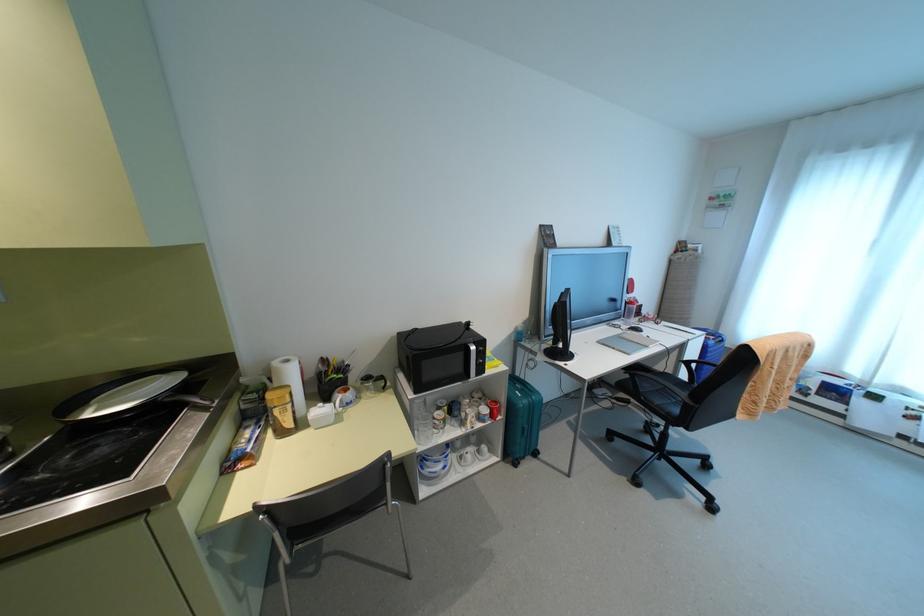
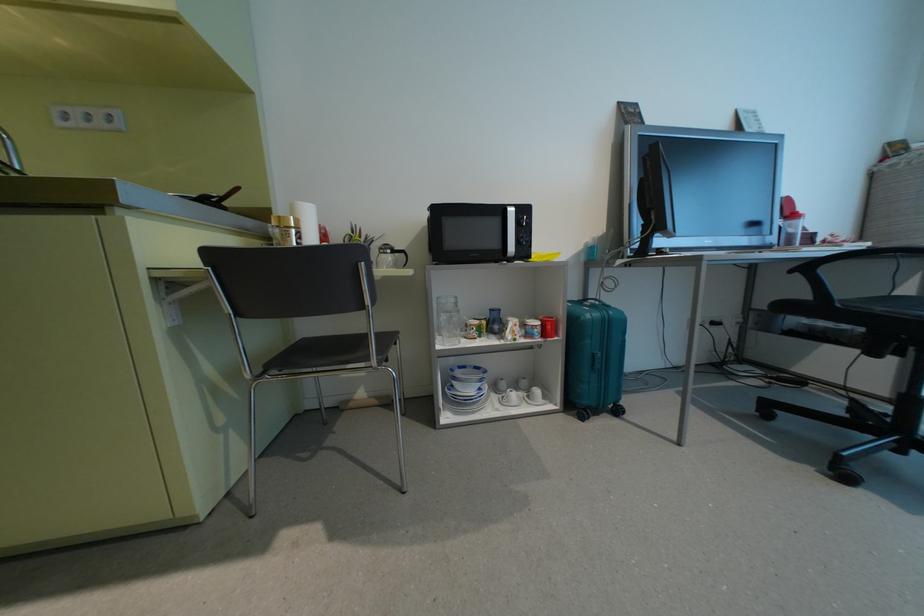
Question: Based on the continuous images, in which direction is the camera rotating? Reply with the corresponding letter.

Choices:
 (A) Left
 (B) Right
 (C) Up
 (D) Down

Answer: (A)